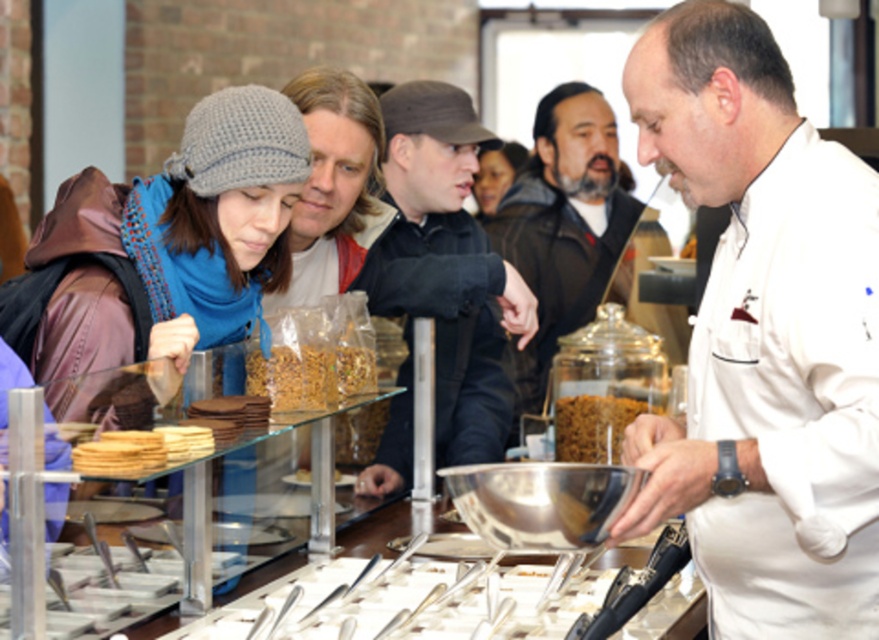
You are trying to decide whether to wear your knitted gray hat at left and dark brown leather jacket at center together. Based on their thickness, will they fit comfortably under a narrow coat rack?

The knitted gray hat at left is thinner than the dark brown leather jacket at center. Since the hat is thinner, it can be placed under the coat rack alongside the jacket, but the total combined thickness may still depend on the coat rack width. However, individually, the hat takes less space than the jacket.

You are a customer at the food counter and want to grab the brown crunchy granola at center. However, there is a person with smooth brown hair at center in front of you. Can you reach the granola without moving the person?

The brown crunchy granola at center is positioned under the smooth brown hair at center, so you can reach it without moving the person as it is located beneath them.